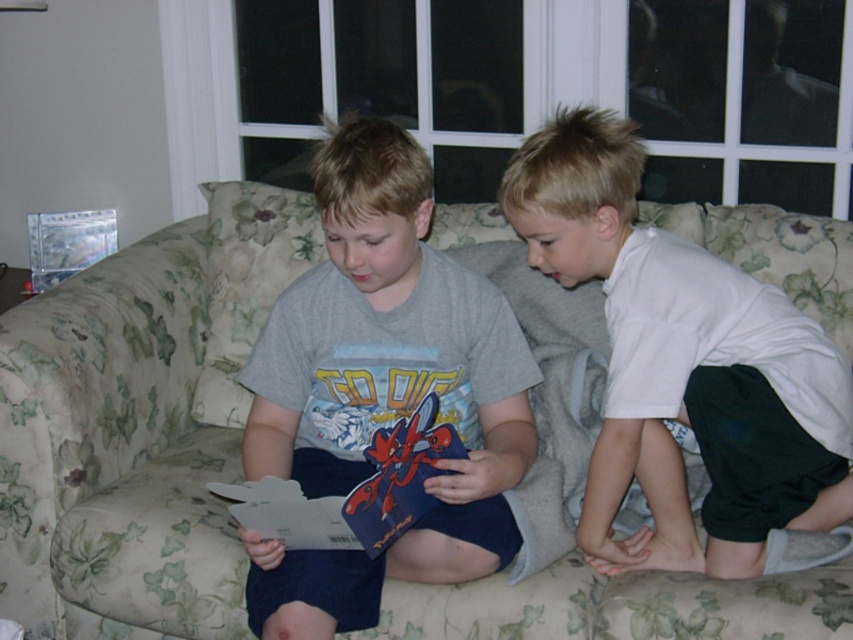
Question: Is the position of gray cotton shirt at center more distant than that of white cotton shirt at right?

Choices:
 (A) no
 (B) yes

Answer: (A)

Question: Does gray cotton shirt at center have a greater width compared to white cotton shirt at right?

Choices:
 (A) yes
 (B) no

Answer: (B)

Question: Which point is closer to the camera?

Choices:
 (A) (256, 595)
 (B) (296, 483)
 (C) (33, 560)
 (D) (703, 324)

Answer: (B)

Question: Which object appears farthest from the camera in this image?

Choices:
 (A) gray cotton shirt at center
 (B) floral fabric couch at center

Answer: (B)

Question: Can you confirm if floral fabric couch at center is positioned above gray cotton shirt at center?

Choices:
 (A) yes
 (B) no

Answer: (B)

Question: Which object is positioned farthest from the floral fabric couch at center?

Choices:
 (A) blue matte book at center
 (B) white cotton shirt at right
 (C) gray cotton shirt at center

Answer: (B)